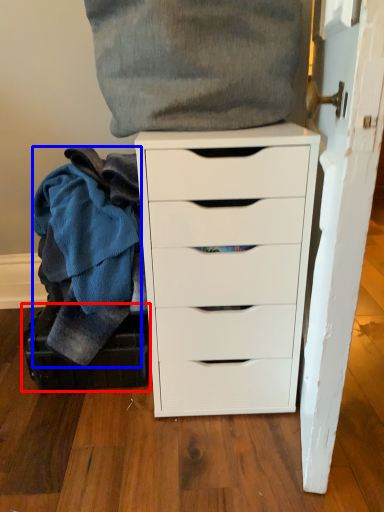
Question: Which of the following is the closest to the observer, luggage (highlighted by a red box) or clothing (highlighted by a blue box)?

Choices:
 (A) luggage
 (B) clothing

Answer: (B)